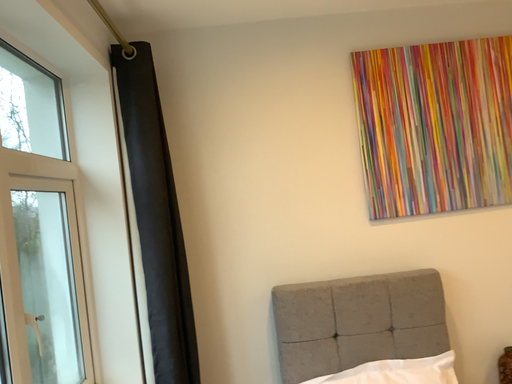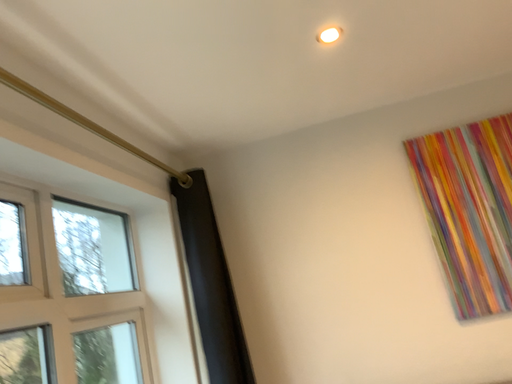
Question: How did the camera likely rotate when shooting the video?

Choices:
 (A) rotated right
 (B) rotated left

Answer: (B)